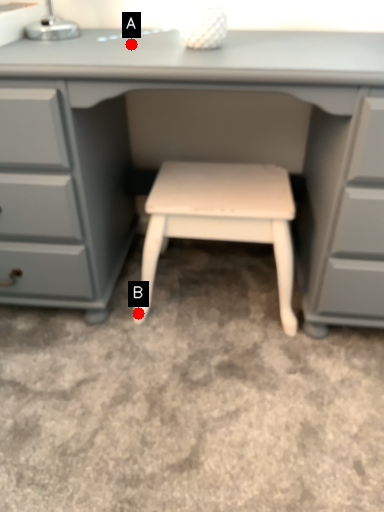
Question: Two points are circled on the image, labeled by A and B beside each circle. Which point appears farthest from the camera in this image?

Choices:
 (A) A is further
 (B) B is further

Answer: (B)